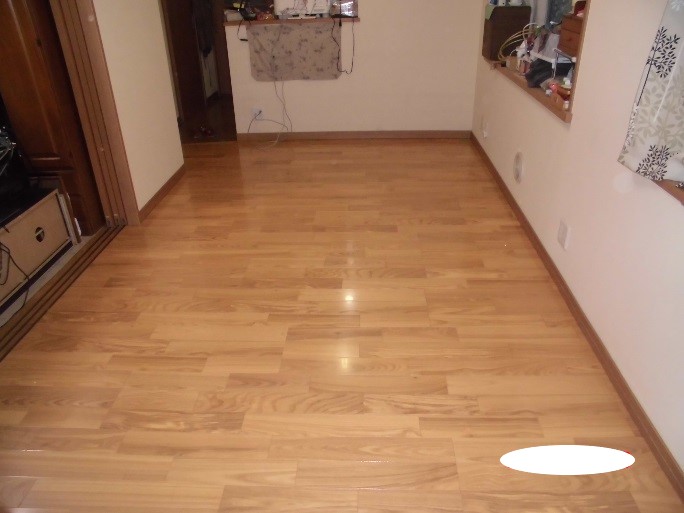
You are a GUI agent. You are given a task and a screenshot of the screen. Output one action in this format:
    pyautogui.click(x=<x>, y=<y>)
    Task: Click on the cloth
    The width and height of the screenshot is (684, 513).
    Given the screenshot: What is the action you would take?
    pyautogui.click(x=291, y=69)